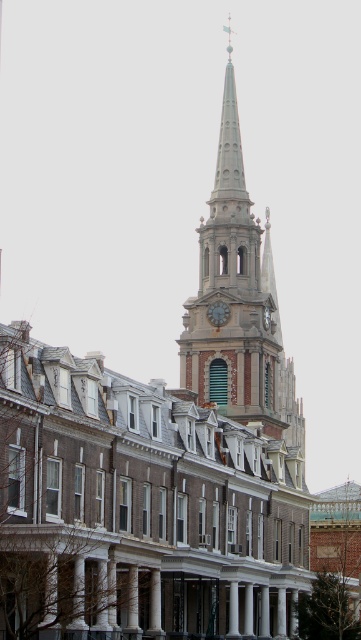
Can you confirm if smooth gray steeple at center is positioned above green stone clock at center?

Yes, smooth gray steeple at center is above green stone clock at center.

Between smooth gray steeple at center and green stone clock at center, which one appears on the left side from the viewer's perspective?

Positioned to the left is green stone clock at center.

Between point (250, 300) and point (218, 314), which one is positioned in front?

Positioned in front is point (250, 300).

The width and height of the screenshot is (361, 640). In order to click on smooth gray steeple at center in this screenshot , I will do `click(237, 301)`.